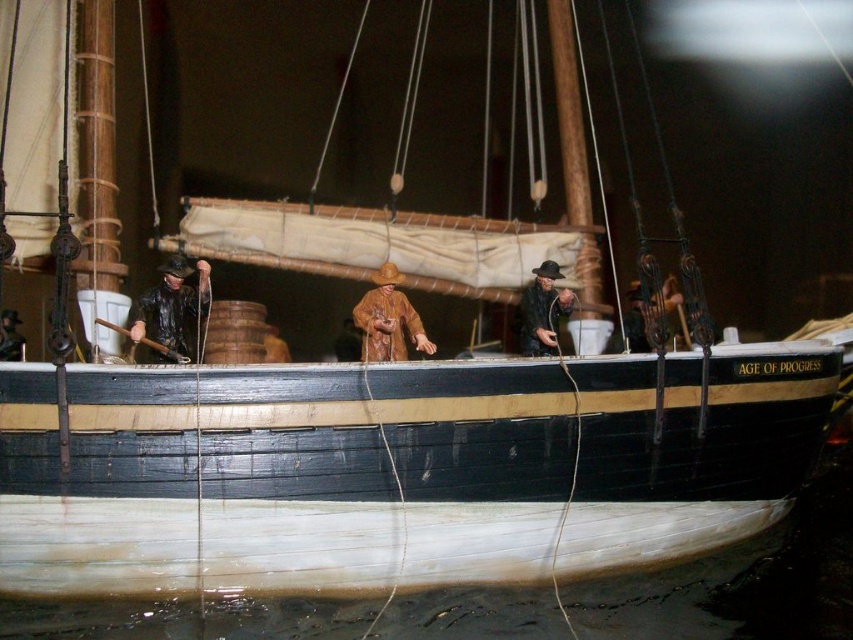
Does matte brown leather hat at center appear under brown leather coat at center?

No.

Is point (541, 323) farther from camera compared to point (274, 360)?

No, it is not.

This screenshot has width=853, height=640. Find the location of `matte brown leather hat at center`. matte brown leather hat at center is located at coordinates (543, 310).

Is matte black coat at left positioned behind brown matte figure at center?

No, matte black coat at left is closer to the viewer.

Who is higher up, matte black coat at left or brown matte figure at center?

Positioned higher is brown matte figure at center.

Between point (170, 308) and point (368, 352), which one is positioned behind?

The point (368, 352) is more distant.

Where is `matte black coat at left`? matte black coat at left is located at coordinates (173, 310).

Which is more to the right, matte black coat at left or brown leather coat at center?

brown leather coat at center is more to the right.

Which is behind, point (138, 336) or point (282, 353)?

Point (282, 353)

Find the location of a particular element. matte black coat at left is located at coordinates (173, 310).

Locate an element on the screen. The image size is (853, 640). matte black coat at left is located at coordinates (173, 310).